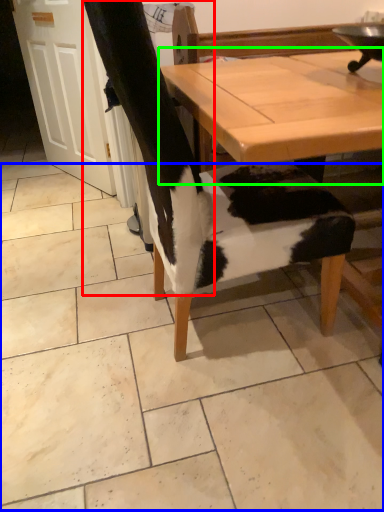
Question: Which object is positioned farthest from leg (highlighted by a red box)? Select from tile (highlighted by a blue box) and table (highlighted by a green box).

Choices:
 (A) tile
 (B) table

Answer: (A)